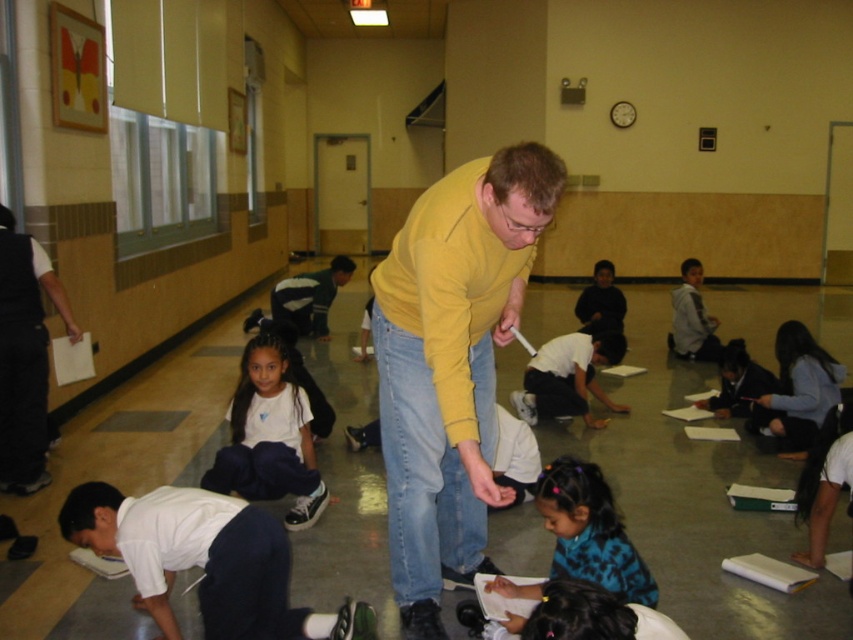
You are a photographer standing in the classroom and want to capture a photo that includes both the white matte shirt at lower left and the white matte shirt at center. Which of the two shirts should you focus on if you want to highlight the wider one in your composition?

The white matte shirt at center is wider, so focusing on it would highlight the wider one in the composition.

You are a photographer standing in the classroom and want to take a photo of the yellow matte sweater at center. You have a camera that has a minimum focusing distance of 2 meters. Can you take the photo without moving closer?

The yellow matte sweater at center and camera are 2.15 meters apart. Since the minimum focusing distance is 2 meters, the photographer can take the photo without moving closer because the distance is sufficient.

You are a photographer standing at the back of the classroom. You want to take a photo that includes both the yellow matte sweater at center and the white matte shirt at lower left. Which of the two objects should be placed closer to the camera to ensure both are fully visible in the frame?

The yellow matte sweater at center is taller than the white matte shirt at lower left, so placing the taller yellow matte sweater at center closer to the camera will help ensure both are fully visible in the frame.